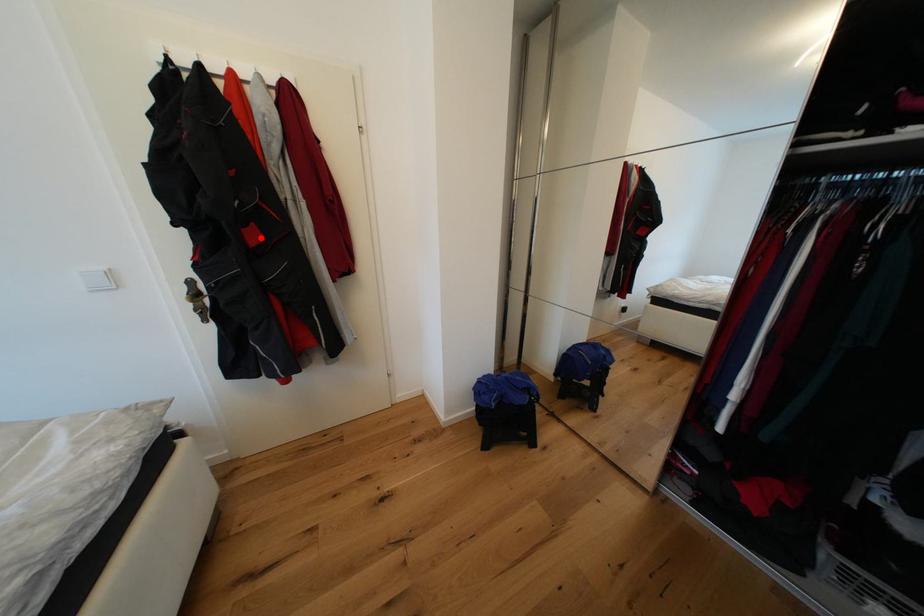
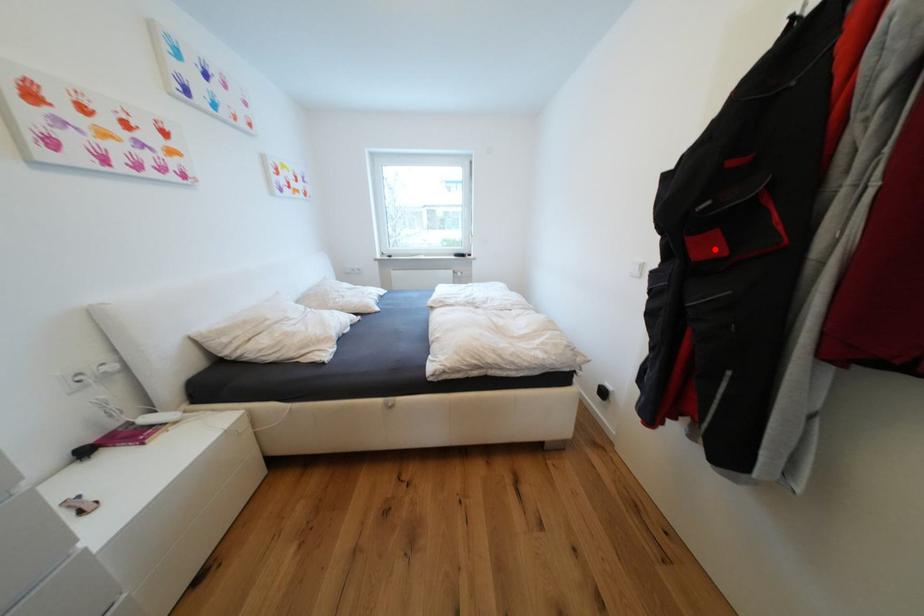
I am providing you with two images of the same scene from different viewpoints. A red point is marked on the first image and another point is marked on the second image. Does the point marked in image1 correspond to the same location as the one in image2?

Yes